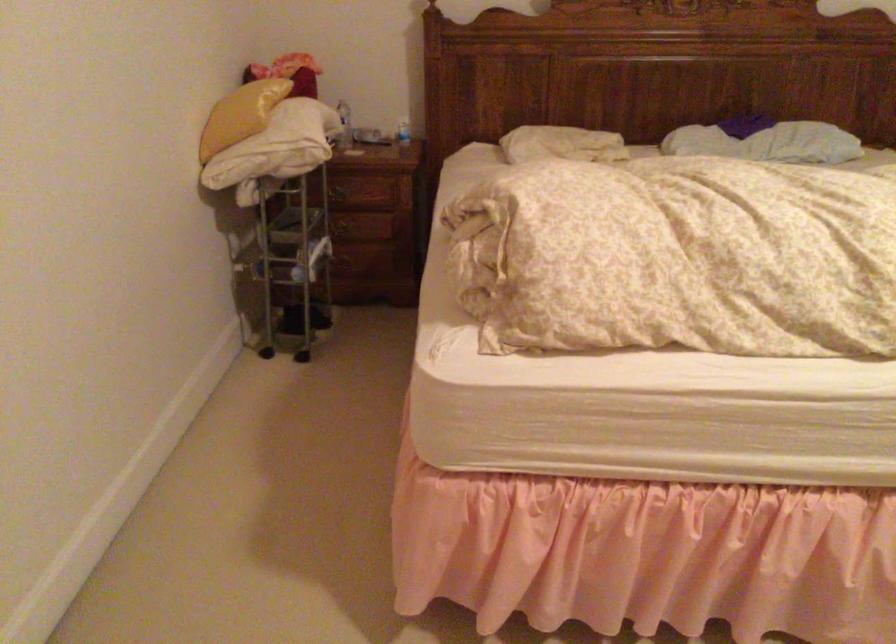
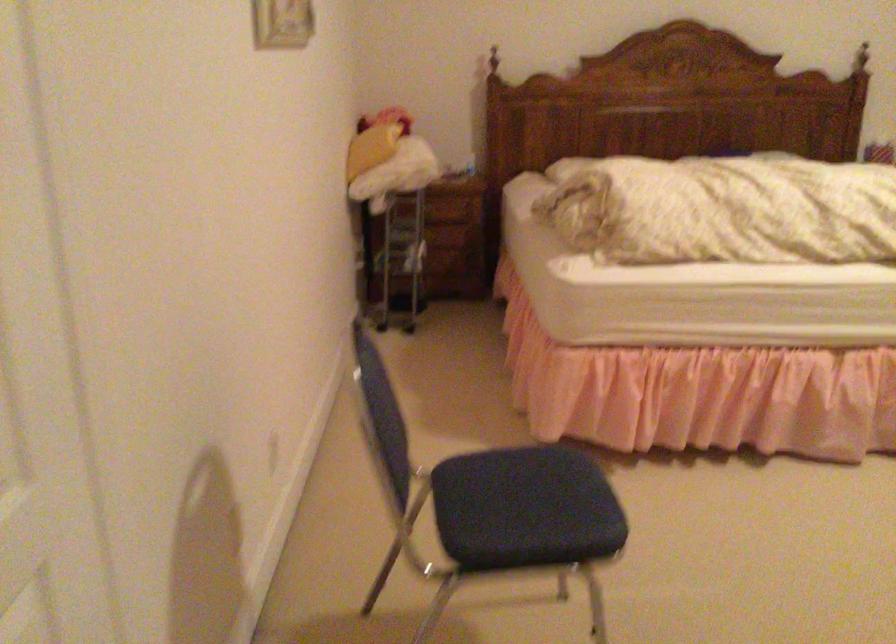
In a continuous first-person perspective shot, in which direction is the camera moving?

The movement direction of the cameraman is left, backward.